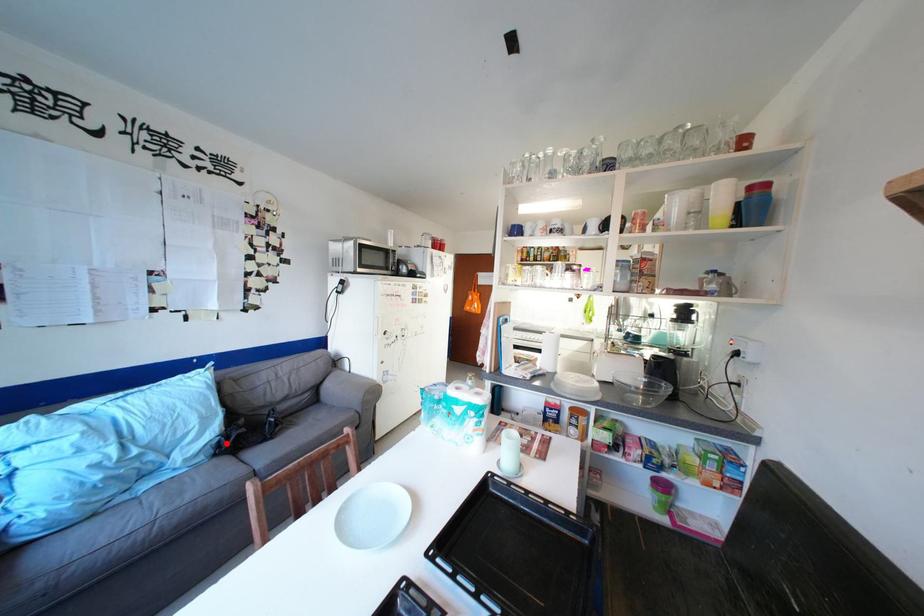
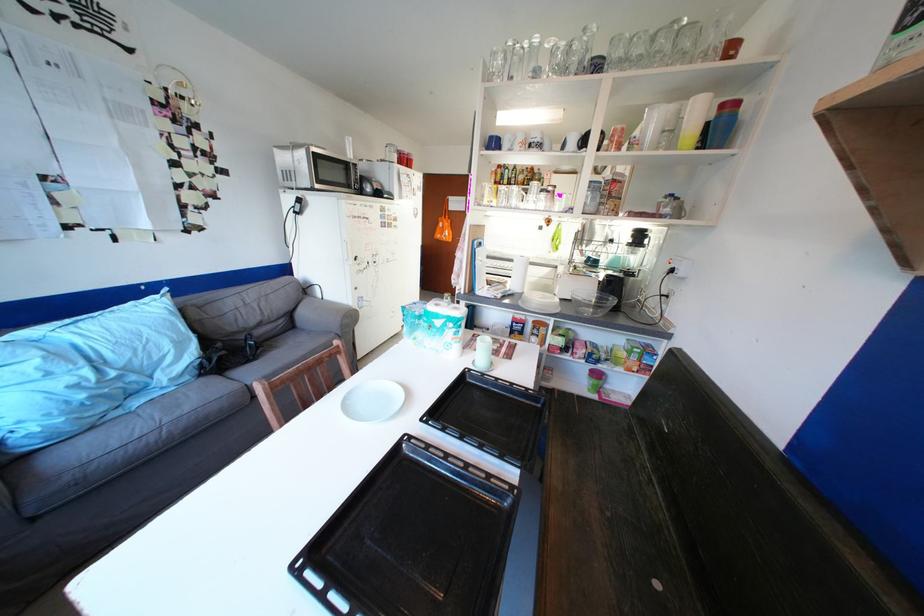
Find the pixel in the second image that matches the highlighted location in the first image.

(209, 365)